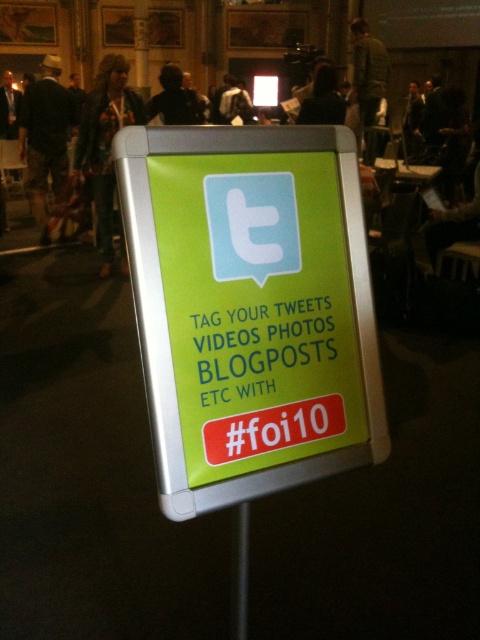
Between point (163, 196) and point (84, 148), which one is positioned in front?

Point (163, 196) is in front.

This screenshot has height=640, width=480. Describe the element at coordinates (251, 308) in the screenshot. I see `green plastic sign at center` at that location.

The image size is (480, 640). What do you see at coordinates (251, 308) in the screenshot?
I see `green plastic sign at center` at bounding box center [251, 308].

The image size is (480, 640). Find the location of `green plastic sign at center`. green plastic sign at center is located at coordinates (251, 308).

Who is more forward, (156, 248) or (72, 109)?

Positioned in front is point (156, 248).

Can you confirm if green plastic sign at center is positioned above denim shorts at left?

No.

Does point (290, 244) come behind point (45, 237)?

No, (290, 244) is in front of (45, 237).

Locate an element on the screen. The height and width of the screenshot is (640, 480). green plastic sign at center is located at coordinates (251, 308).

Between point (98, 93) and point (168, 104), which one is positioned behind?

The point (168, 104) is more distant.

The width and height of the screenshot is (480, 640). What are the coordinates of `leather jacket at upper left` in the screenshot? It's located at (105, 141).

Is point (97, 220) positioned before point (186, 92)?

Yes, it is.

Image resolution: width=480 pixels, height=640 pixels. Find the location of `leather jacket at upper left`. leather jacket at upper left is located at coordinates (105, 141).